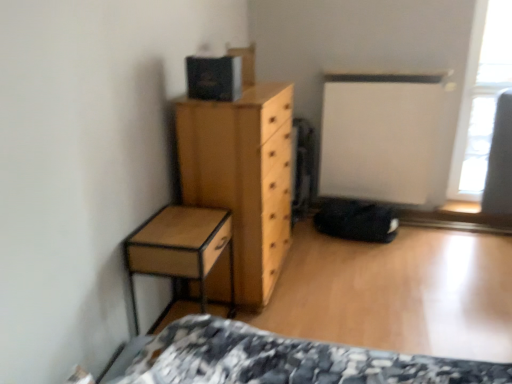
Question: Considering the relative positions of transparent glass window at upper right and light brown wood chest of drawers at center in the image provided, is transparent glass window at upper right to the right of light brown wood chest of drawers at center from the viewer's perspective?

Choices:
 (A) no
 (B) yes

Answer: (B)

Question: Is transparent glass window at upper right positioned behind light brown wood chest of drawers at center?

Choices:
 (A) no
 (B) yes

Answer: (B)

Question: Considering the relative sizes of transparent glass window at upper right and light brown wood chest of drawers at center in the image provided, is transparent glass window at upper right wider than light brown wood chest of drawers at center?

Choices:
 (A) no
 (B) yes

Answer: (A)

Question: From a real-world perspective, is transparent glass window at upper right on light brown wood chest of drawers at center?

Choices:
 (A) yes
 (B) no

Answer: (A)

Question: Considering the relative positions of transparent glass window at upper right and light brown wood chest of drawers at center in the image provided, is transparent glass window at upper right in front of light brown wood chest of drawers at center?

Choices:
 (A) yes
 (B) no

Answer: (B)

Question: From a real-world perspective, is light brown wood chest of drawers at center physically located above or below wooden nightstand at left?

Choices:
 (A) above
 (B) below

Answer: (A)

Question: In terms of size, does light brown wood chest of drawers at center appear bigger or smaller than wooden nightstand at left?

Choices:
 (A) big
 (B) small

Answer: (A)

Question: Does point (287, 216) appear closer or farther from the camera than point (173, 226)?

Choices:
 (A) farther
 (B) closer

Answer: (A)

Question: Would you say light brown wood chest of drawers at center is inside or outside wooden nightstand at left?

Choices:
 (A) inside
 (B) outside

Answer: (B)

Question: Would you say wooden nightstand at left is to the left or to the right of light brown wood chest of drawers at center in the picture?

Choices:
 (A) left
 (B) right

Answer: (A)

Question: Is wooden nightstand at left in front of or behind light brown wood chest of drawers at center in the image?

Choices:
 (A) front
 (B) behind

Answer: (A)

Question: From the image's perspective, is wooden nightstand at left above or below light brown wood chest of drawers at center?

Choices:
 (A) above
 (B) below

Answer: (B)

Question: Looking at their shapes, would you say wooden nightstand at left is wider or thinner than light brown wood chest of drawers at center?

Choices:
 (A) wide
 (B) thin

Answer: (B)

Question: In terms of height, does light brown wood chest of drawers at center look taller or shorter compared to transparent glass window at upper right?

Choices:
 (A) tall
 (B) short

Answer: (B)

Question: Is light brown wood chest of drawers at center to the left or to the right of transparent glass window at upper right in the image?

Choices:
 (A) left
 (B) right

Answer: (A)